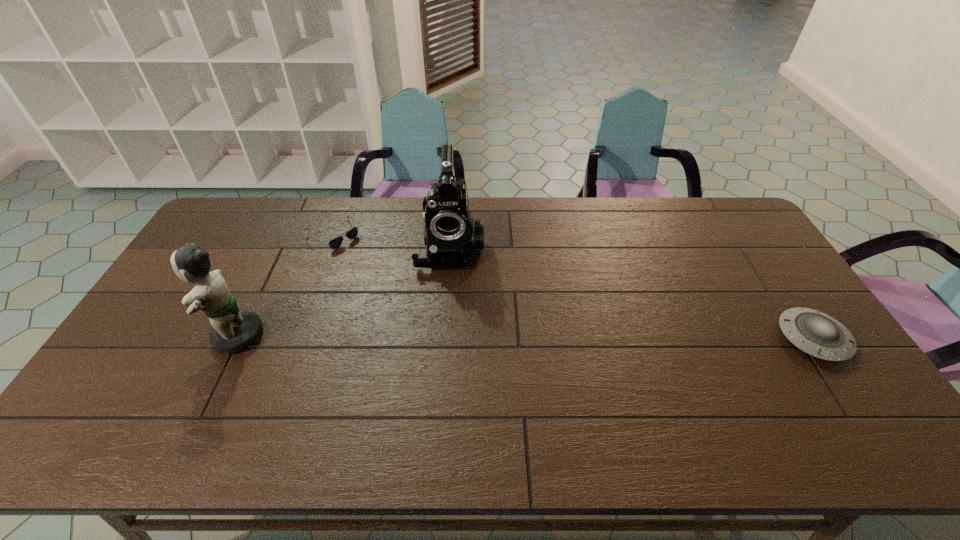
Find the location of a particular element. The width and height of the screenshot is (960, 540). vacant space on the desktop that is between the leftmost object and the rightmost object and is positioned on the lens mount of the second object from right to left is located at coordinates (449, 336).

Locate an element on the screen. This screenshot has width=960, height=540. vacant space on the desktop that is between the figurine and the saucer and is positioned on the lenses of the second object from left to right is located at coordinates (471, 336).